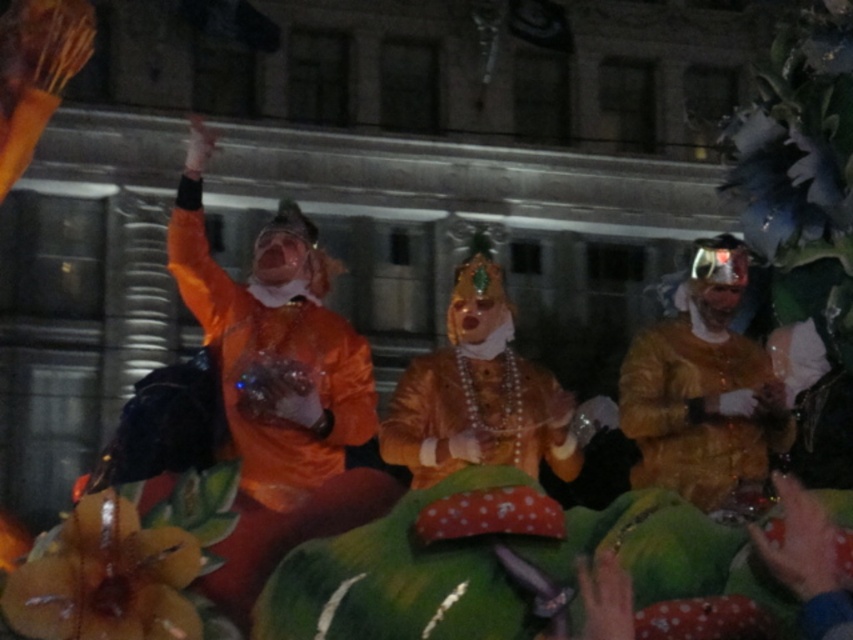
Who is shorter, gold satin mask at center or gold shiny fabric at right?

gold shiny fabric at right is shorter.

Who is positioned more to the left, gold satin mask at center or gold shiny fabric at right?

gold satin mask at center

Who is more distant from viewer, (467, 417) or (683, 320)?

The point (683, 320) is more distant.

This screenshot has height=640, width=853. I want to click on gold satin mask at center, so click(479, 394).